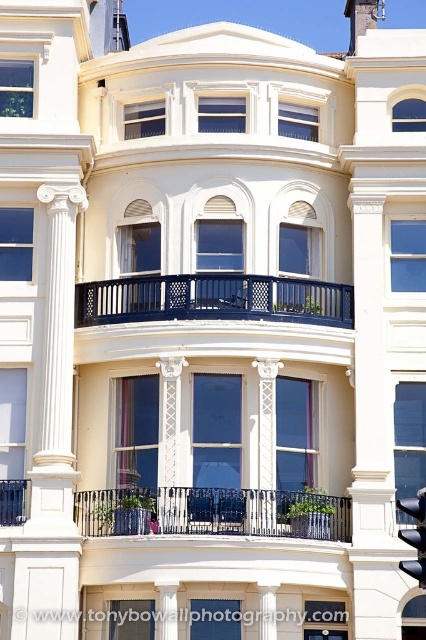
Between black wrought iron balcony at center and black glass traffic light at center, which one has less height?

black wrought iron balcony at center

Does black wrought iron balcony at center lie in front of black glass traffic light at center?

No, black wrought iron balcony at center is further to the viewer.

Is point (158, 506) closer to camera compared to point (417, 544)?

No.

The width and height of the screenshot is (426, 640). Identify the location of black wrought iron balcony at center. (213, 513).

Can you confirm if matte black balcony at center is thinner than black glass traffic light at center?

No.

Does matte black balcony at center come behind black glass traffic light at center?

That is True.

Is point (224, 307) farther from camera compared to point (400, 564)?

Yes, it is behind point (400, 564).

I want to click on matte black balcony at center, so click(x=213, y=300).

Which is below, black wrought iron balcony at center or matte black balcony at center?

Positioned lower is black wrought iron balcony at center.

Who is more distant from viewer, (210,529) or (164,298)?

Point (164,298)

This screenshot has width=426, height=640. What are the coordinates of `black wrought iron balcony at center` in the screenshot? It's located at (213, 513).